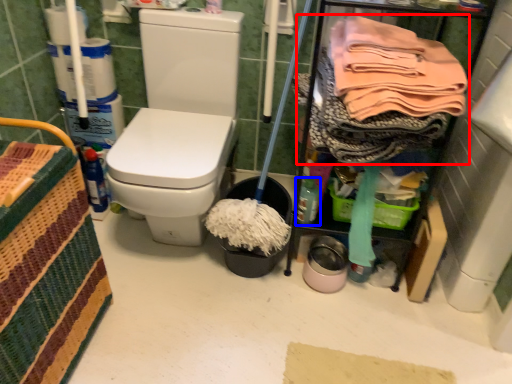
Question: Which object is further to the camera taking this photo, clothing (highlighted by a red box) or bottle (highlighted by a blue box)?

Choices:
 (A) clothing
 (B) bottle

Answer: (B)